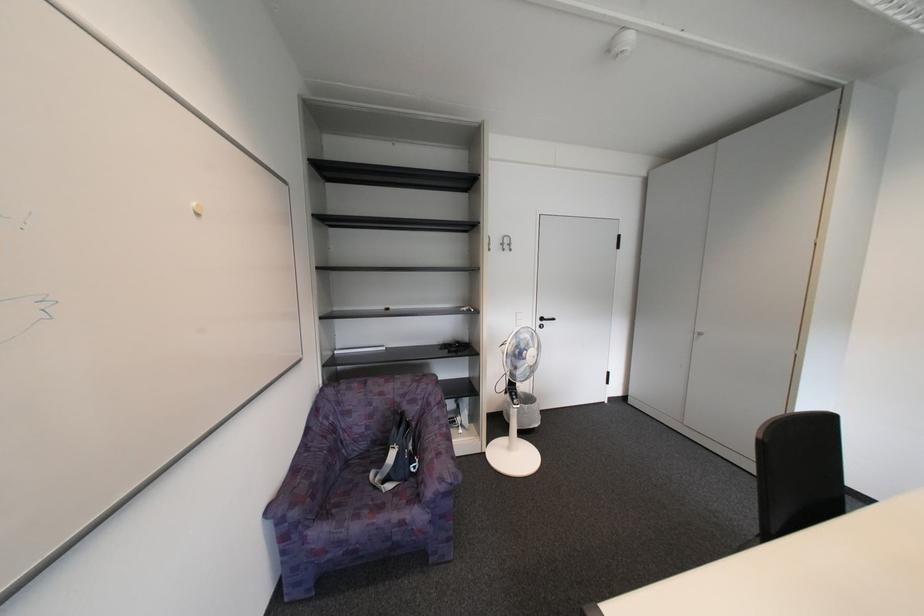
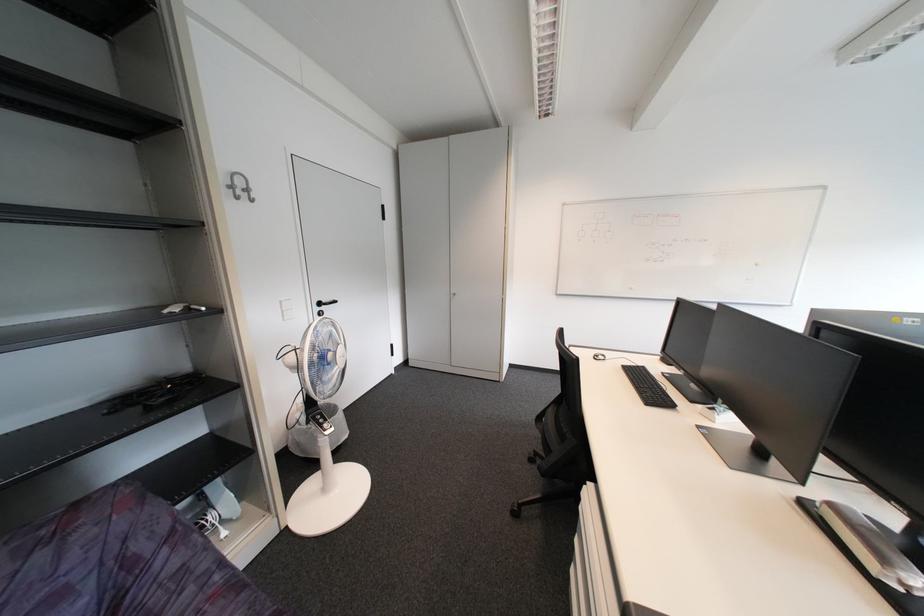
Question: How did the camera likely rotate?

Choices:
 (A) Left
 (B) Right
 (C) Up
 (D) Down

Answer: (B)